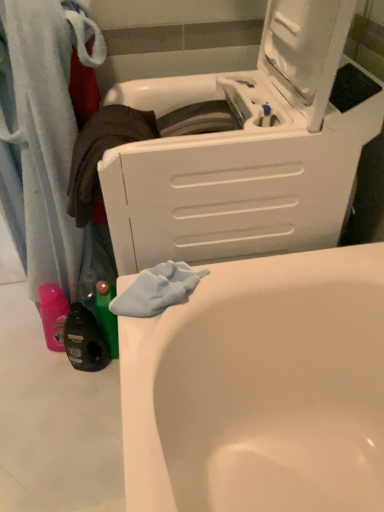
Question: Is white plastic washing machine at upper center to the right of white glossy bathtub at lower left from the viewer's perspective?

Choices:
 (A) no
 (B) yes

Answer: (B)

Question: Does white plastic washing machine at upper center come behind white glossy bathtub at lower left?

Choices:
 (A) no
 (B) yes

Answer: (A)

Question: Can you confirm if white plastic washing machine at upper center is bigger than white glossy bathtub at lower left?

Choices:
 (A) yes
 (B) no

Answer: (A)

Question: Is white plastic washing machine at upper center facing away from white glossy bathtub at lower left?

Choices:
 (A) yes
 (B) no

Answer: (B)

Question: From the image's perspective, would you say white plastic washing machine at upper center is shown under white glossy bathtub at lower left?

Choices:
 (A) yes
 (B) no

Answer: (B)

Question: Is white plastic washing machine at upper center wider than white glossy bathtub at lower left?

Choices:
 (A) yes
 (B) no

Answer: (B)

Question: From a real-world perspective, is white glossy bathtub at lower left positioned under white plastic washing machine at upper center based on gravity?

Choices:
 (A) no
 (B) yes

Answer: (B)

Question: Does white glossy bathtub at lower left appear on the right side of white plastic washing machine at upper center?

Choices:
 (A) yes
 (B) no

Answer: (B)

Question: Is white glossy bathtub at lower left behind white plastic washing machine at upper center?

Choices:
 (A) no
 (B) yes

Answer: (B)

Question: Is white glossy bathtub at lower left far away from white plastic washing machine at upper center?

Choices:
 (A) no
 (B) yes

Answer: (A)

Question: Is white glossy bathtub at lower left with white plastic washing machine at upper center?

Choices:
 (A) no
 (B) yes

Answer: (A)

Question: Is white plastic washing machine at upper center at the back of white glossy bathtub at lower left?

Choices:
 (A) yes
 (B) no

Answer: (B)

Question: Is white plastic washing machine at upper center bigger or smaller than white glossy bathtub at lower left?

Choices:
 (A) big
 (B) small

Answer: (A)